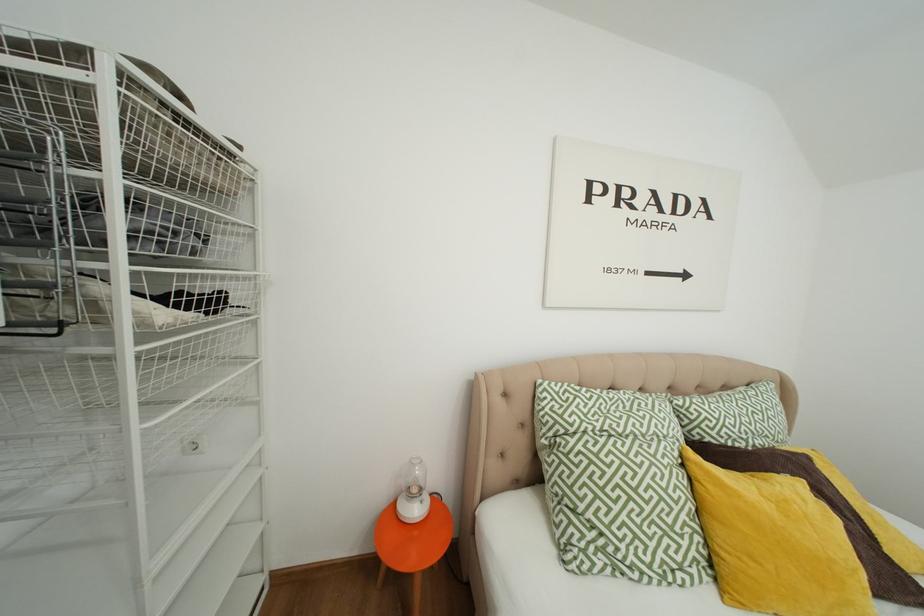
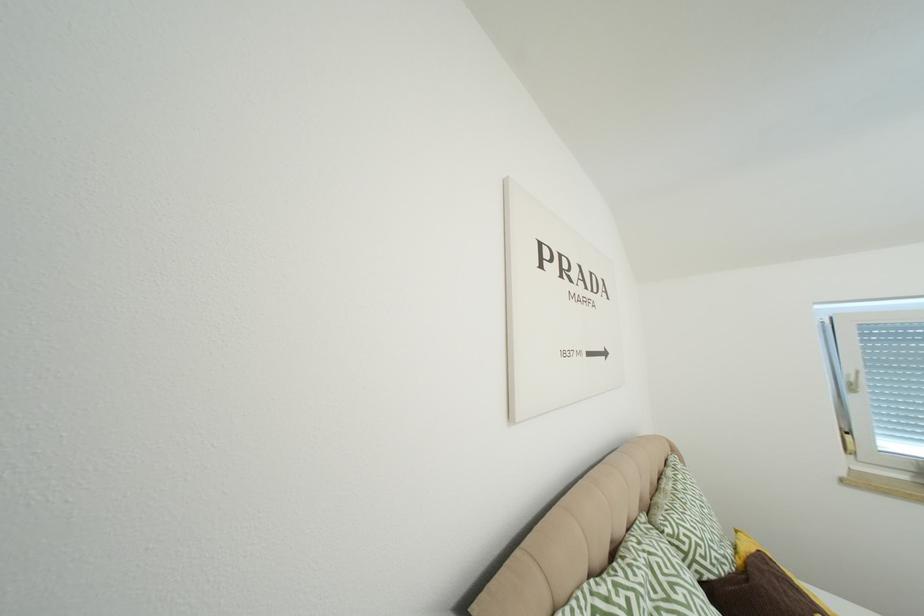
Question: How did the camera likely rotate?

Choices:
 (A) Left
 (B) Right
 (C) Up
 (D) Down

Answer: (B)